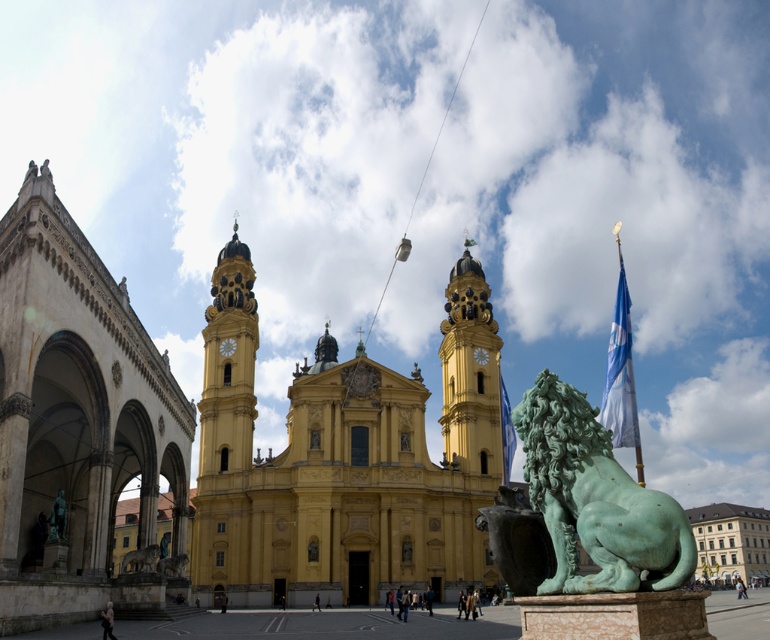
Question: Among these points, which one is nearest to the camera?

Choices:
 (A) (581, 486)
 (B) (273, 572)

Answer: (A)

Question: Which of the following is the farthest from the observer?

Choices:
 (A) (460, 445)
 (B) (658, 497)

Answer: (A)

Question: Does yellow stone church at center appear on the left side of green patina lion at lower right?

Choices:
 (A) yes
 (B) no

Answer: (A)

Question: Does yellow stone church at center appear over green patina lion at lower right?

Choices:
 (A) yes
 (B) no

Answer: (A)

Question: Which object appears farthest from the camera in this image?

Choices:
 (A) yellow stone church at center
 (B) green patina lion at lower right

Answer: (A)

Question: Observing the image, what is the correct spatial positioning of yellow stone church at center in reference to green patina lion at lower right?

Choices:
 (A) right
 (B) left

Answer: (B)